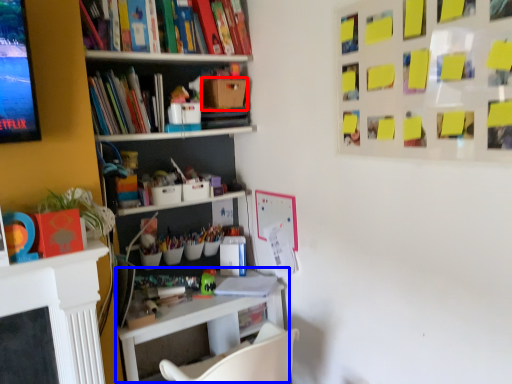
Question: Which of the following is the closest to the observer, cardboard box (highlighted by a red box) or table (highlighted by a blue box)?

Choices:
 (A) cardboard box
 (B) table

Answer: (B)